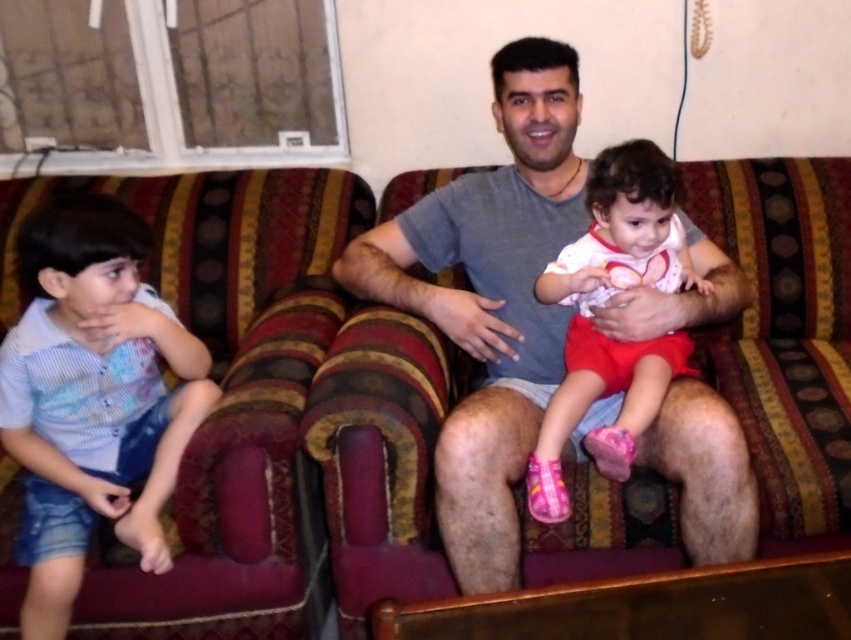
You are a delivery person trying to place a small package between the gray cotton shirt at center and the blue striped shirt at left. The package is 24 inches long. Can you fit it between them without moving either shirt?

The distance between the gray cotton shirt at center and the blue striped shirt at left is 24.20 inches. Since the package is 24 inches long, it can fit between them as there is enough space.

Based on the provided scene, where exactly is the blue striped shirt at left located in terms of coordinates?

The blue striped shirt at left is located at coordinates 0.622 on the x axis and 0.109 on the y axis.